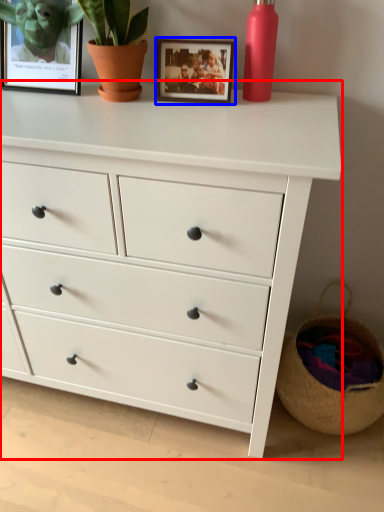
Question: Which object appears closest to the camera in this image, chest of drawers (highlighted by a red box) or picture frame (highlighted by a blue box)?

Choices:
 (A) chest of drawers
 (B) picture frame

Answer: (A)